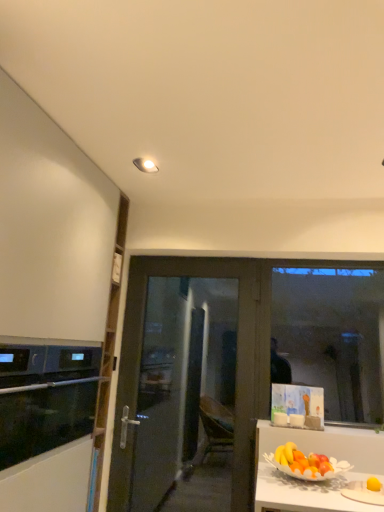
Question: Is transparent glass window at right in contact with transparent glass door at center?

Choices:
 (A) yes
 (B) no

Answer: (B)

Question: From a real-world perspective, is transparent glass window at right on transparent glass door at center?

Choices:
 (A) no
 (B) yes

Answer: (B)

Question: Is there a large distance between transparent glass window at right and transparent glass door at center?

Choices:
 (A) yes
 (B) no

Answer: (A)

Question: Is transparent glass window at right looking in the opposite direction of transparent glass door at center?

Choices:
 (A) no
 (B) yes

Answer: (A)

Question: From a real-world perspective, is transparent glass window at right physically below transparent glass door at center?

Choices:
 (A) no
 (B) yes

Answer: (A)

Question: Is transparent glass window at right to the right of transparent glass door at center from the viewer's perspective?

Choices:
 (A) no
 (B) yes

Answer: (B)

Question: Does transparent glass window at right come behind black glass oven at left?

Choices:
 (A) yes
 (B) no

Answer: (A)

Question: Is transparent glass window at right taller than black glass oven at left?

Choices:
 (A) yes
 (B) no

Answer: (A)

Question: Is transparent glass window at right wider than black glass oven at left?

Choices:
 (A) yes
 (B) no

Answer: (B)

Question: Are transparent glass window at right and black glass oven at left located far from each other?

Choices:
 (A) no
 (B) yes

Answer: (B)

Question: Is transparent glass window at right looking in the opposite direction of black glass oven at left?

Choices:
 (A) yes
 (B) no

Answer: (B)

Question: Can you confirm if transparent glass window at right is smaller than black glass oven at left?

Choices:
 (A) no
 (B) yes

Answer: (B)

Question: From a real-world perspective, is white matte cabinet at left positioned over black glass oven at left based on gravity?

Choices:
 (A) no
 (B) yes

Answer: (B)